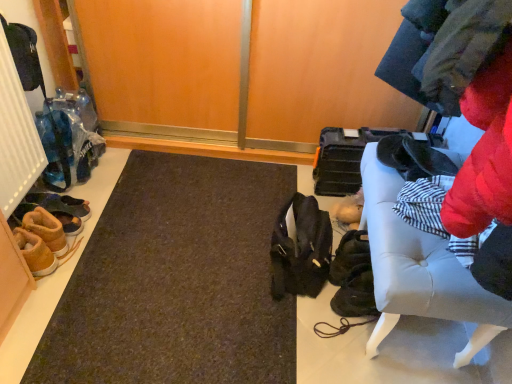
Question: Considering the relative positions of tan suede boot at lower left, marked as the fourth footwear in a back-to-front arrangement, and white leather bench at right in the image provided, is tan suede boot at lower left, marked as the fourth footwear in a back-to-front arrangement, behind white leather bench at right?

Choices:
 (A) no
 (B) yes

Answer: (B)

Question: Can you confirm if tan suede boot at lower left, arranged as the first footwear when viewed from the front, is bigger than white leather bench at right?

Choices:
 (A) no
 (B) yes

Answer: (A)

Question: Is tan suede boot at lower left, marked as the fourth footwear in a back-to-front arrangement, to the right of white leather bench at right from the viewer's perspective?

Choices:
 (A) no
 (B) yes

Answer: (A)

Question: Is tan suede boot at lower left, marked as the fourth footwear in a back-to-front arrangement, positioned with its back to white leather bench at right?

Choices:
 (A) yes
 (B) no

Answer: (B)

Question: Is tan suede boot at lower left, arranged as the first footwear when viewed from the front, outside white leather bench at right?

Choices:
 (A) no
 (B) yes

Answer: (B)

Question: Considering the relative sizes of tan suede boot at lower left, arranged as the first footwear when viewed from the front, and white leather bench at right in the image provided, is tan suede boot at lower left, arranged as the first footwear when viewed from the front, shorter than white leather bench at right?

Choices:
 (A) yes
 (B) no

Answer: (A)

Question: Can you confirm if white leather bench at right is taller than tan suede boot at lower left, arranged as the first footwear when viewed from the front?

Choices:
 (A) yes
 (B) no

Answer: (A)

Question: Considering the relative sizes of white leather bench at right and tan suede boot at lower left, marked as the fourth footwear in a back-to-front arrangement, in the image provided, is white leather bench at right shorter than tan suede boot at lower left, marked as the fourth footwear in a back-to-front arrangement,?

Choices:
 (A) no
 (B) yes

Answer: (A)

Question: Is white leather bench at right looking in the opposite direction of tan suede boot at lower left, marked as the fourth footwear in a back-to-front arrangement?

Choices:
 (A) no
 (B) yes

Answer: (A)

Question: From the image's perspective, does white leather bench at right appear higher than tan suede boot at lower left, arranged as the first footwear when viewed from the front?

Choices:
 (A) no
 (B) yes

Answer: (B)

Question: Considering the relative sizes of white leather bench at right and tan suede boot at lower left, arranged as the first footwear when viewed from the front, in the image provided, is white leather bench at right bigger than tan suede boot at lower left, arranged as the first footwear when viewed from the front,?

Choices:
 (A) no
 (B) yes

Answer: (B)

Question: Is white leather bench at right wider than tan suede boot at lower left, arranged as the first footwear when viewed from the front?

Choices:
 (A) yes
 (B) no

Answer: (A)

Question: From the image's perspective, would you say brown suede shoes at lower left, arranged as the second footwear when viewed from the front, is positioned over leather sandal at left, acting as the 4th footwear starting from the front?

Choices:
 (A) yes
 (B) no

Answer: (B)